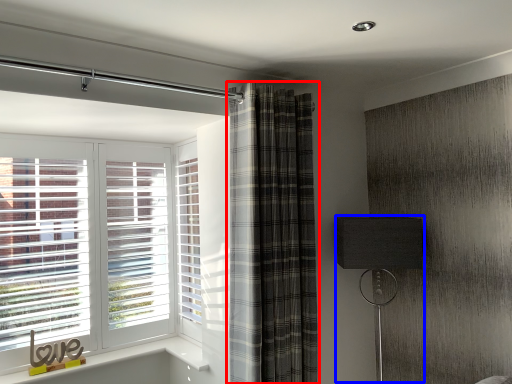
Question: Which of the following is the closest to the observer, curtain (highlighted by a red box) or table lamp (highlighted by a blue box)?

Choices:
 (A) curtain
 (B) table lamp

Answer: (A)